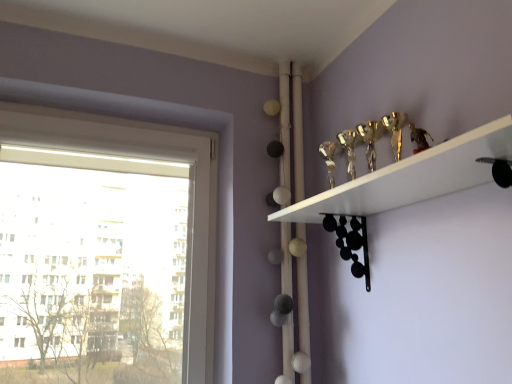
Question: Can you confirm if gold metallic trophy at upper right is bigger than white plastic window at left?

Choices:
 (A) no
 (B) yes

Answer: (A)

Question: Is gold metallic trophy at upper right completely or partially outside of white plastic window at left?

Choices:
 (A) yes
 (B) no

Answer: (A)

Question: Could white plastic window at left be considered to be inside gold metallic trophy at upper right?

Choices:
 (A) yes
 (B) no

Answer: (B)

Question: Is gold metallic trophy at upper right positioned in front of white plastic window at left?

Choices:
 (A) no
 (B) yes

Answer: (B)

Question: From a real-world perspective, is gold metallic trophy at upper right below white plastic window at left?

Choices:
 (A) yes
 (B) no

Answer: (A)

Question: From the image's perspective, is gold metallic trophy at upper right below white plastic window at left?

Choices:
 (A) no
 (B) yes

Answer: (A)

Question: Is white plastic window at left turned away from gold metallic trophy at upper right?

Choices:
 (A) yes
 (B) no

Answer: (B)

Question: Is white plastic window at left smaller than gold metallic trophy at upper right?

Choices:
 (A) no
 (B) yes

Answer: (A)

Question: From a real-world perspective, is white plastic window at left on top of gold metallic trophy at upper right?

Choices:
 (A) yes
 (B) no

Answer: (A)

Question: Does white plastic window at left have a greater width compared to gold metallic trophy at upper right?

Choices:
 (A) yes
 (B) no

Answer: (B)

Question: From a real-world perspective, is white plastic window at left below gold metallic trophy at upper right?

Choices:
 (A) yes
 (B) no

Answer: (B)

Question: Is white plastic window at left behind gold metallic trophy at upper right?

Choices:
 (A) no
 (B) yes

Answer: (B)

Question: Considering the positions of point (419, 198) and point (200, 213), is point (419, 198) closer or farther from the camera than point (200, 213)?

Choices:
 (A) closer
 (B) farther

Answer: (A)